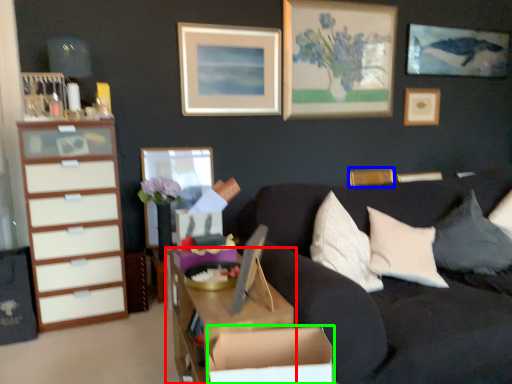
Question: Based on their relative distances, which object is nearer to desk (highlighted by a red box)? Choose from picture frame (highlighted by a blue box) and cardboard box (highlighted by a green box).

Choices:
 (A) picture frame
 (B) cardboard box

Answer: (B)